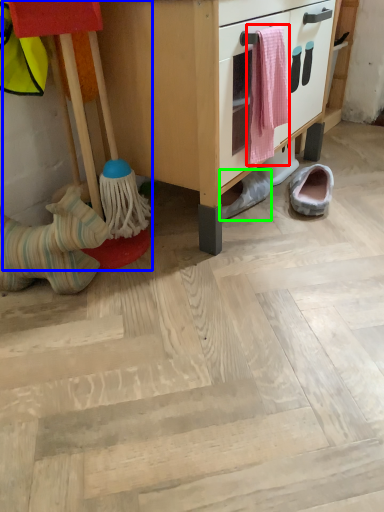
Question: Which object is the farthest from laundry (highlighted by a red box)? Choose among these: toy (highlighted by a blue box) or footwear (highlighted by a green box).

Choices:
 (A) toy
 (B) footwear

Answer: (A)